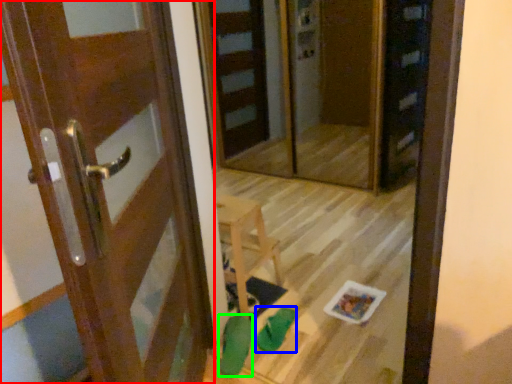
Question: Based on their relative distances, which object is nearer to door (highlighted by a red box)? Choose from shoe (highlighted by a blue box) and shoe (highlighted by a green box).

Choices:
 (A) shoe
 (B) shoe

Answer: (B)